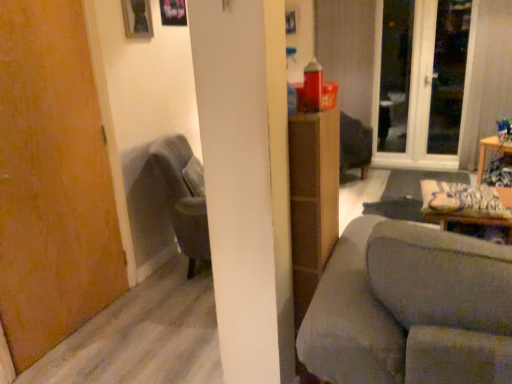
Question: Would you say wooden table at right is to the left or to the right of transparent glass window at upper right in the picture?

Choices:
 (A) left
 (B) right

Answer: (B)

Question: Based on their sizes in the image, would you say wooden table at right is bigger or smaller than transparent glass window at upper right?

Choices:
 (A) big
 (B) small

Answer: (A)

Question: Considering the real-world distances, which object is farthest from the wooden table at right?

Choices:
 (A) velvet grey armchair at left
 (B) wooden door at left
 (C) brown cardboard dresser at center
 (D) gray fabric couch at center
 (E) transparent glass window at upper right

Answer: (B)

Question: Which object is the farthest from the brown cardboard dresser at center?

Choices:
 (A) gray fabric couch at center
 (B) wooden door at left
 (C) wooden table at right
 (D) transparent glass window at upper right
 (E) velvet grey armchair at left

Answer: (D)